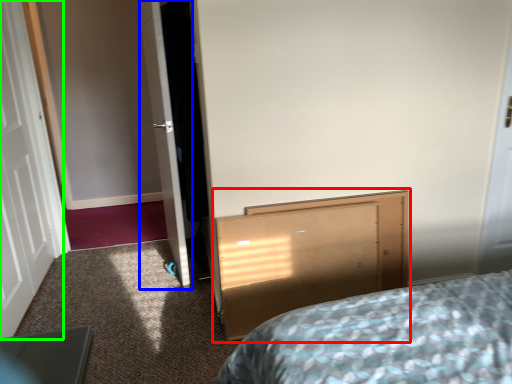
Question: Which object is the closest to the vanity (highlighted by a red box)? Choose among these: door (highlighted by a blue box) or door (highlighted by a green box).

Choices:
 (A) door
 (B) door

Answer: (A)